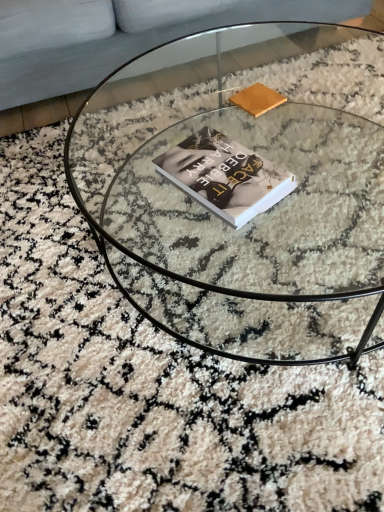
Describe the element at coordinates (257, 99) in the screenshot. I see `matte brown book at upper center` at that location.

This screenshot has height=512, width=384. What do you see at coordinates (236, 201) in the screenshot? I see `transparent glass coffee table at center` at bounding box center [236, 201].

What is the approximate width of transparent glass coffee table at center?

It is 3.38 feet.

The width and height of the screenshot is (384, 512). What do you see at coordinates (225, 176) in the screenshot?
I see `hardcover book at center` at bounding box center [225, 176].

Where is `light gray fabric couch at upper left`? The height and width of the screenshot is (512, 384). light gray fabric couch at upper left is located at coordinates (120, 40).

Is matte brown book at upper center at the back of light gray fabric couch at upper left?

No, light gray fabric couch at upper left's orientation is not away from matte brown book at upper center.

Measure the distance between light gray fabric couch at upper left and matte brown book at upper center.

The distance of light gray fabric couch at upper left from matte brown book at upper center is 31.44 inches.

Can you confirm if light gray fabric couch at upper left is positioned to the right of matte brown book at upper center?

Incorrect, light gray fabric couch at upper left is not on the right side of matte brown book at upper center.

From a real-world perspective, is light gray fabric couch at upper left over matte brown book at upper center?

No, from a real-world perspective, light gray fabric couch at upper left is not on top of matte brown book at upper center.

From the picture: Considering the relative sizes of hardcover book at center and matte brown book at upper center in the image provided, is hardcover book at center shorter than matte brown book at upper center?

In fact, hardcover book at center may be taller than matte brown book at upper center.

Based on the photo, does hardcover book at center appear on the left side of matte brown book at upper center?

Indeed, hardcover book at center is positioned on the left side of matte brown book at upper center.

Based on the photo, from a real-world perspective, is hardcover book at center on matte brown book at upper center?

Yes, from a real-world perspective, hardcover book at center is over matte brown book at upper center

Is hardcover book at center not inside matte brown book at upper center?

Yes, hardcover book at center is outside of matte brown book at upper center.

Considering the sizes of objects transparent glass coffee table at center and hardcover book at center in the image provided, who is taller, transparent glass coffee table at center or hardcover book at center?

transparent glass coffee table at center is taller.

Is transparent glass coffee table at center facing towards hardcover book at center?

No, transparent glass coffee table at center is not oriented towards hardcover book at center.

From the image's perspective, which one is positioned higher, transparent glass coffee table at center or hardcover book at center?

transparent glass coffee table at center is shown above in the image.

What's the angular difference between matte brown book at upper center and transparent glass coffee table at center's facing directions?

16.4 degrees separate the facing orientations of matte brown book at upper center and transparent glass coffee table at center.

Is matte brown book at upper center turned away from transparent glass coffee table at center?

Yes, matte brown book at upper center's orientation is away from transparent glass coffee table at center.

Is matte brown book at upper center smaller than transparent glass coffee table at center?

Yes, matte brown book at upper center is smaller than transparent glass coffee table at center.

From the picture: Are matte brown book at upper center and transparent glass coffee table at center making contact?

No, matte brown book at upper center is not touching transparent glass coffee table at center.

Which is closer to the camera, (x=251, y=103) or (x=355, y=10)?

Point (x=251, y=103)

Considering the relative sizes of matte brown book at upper center and light gray fabric couch at upper left in the image provided, is matte brown book at upper center smaller than light gray fabric couch at upper left?

Correct, matte brown book at upper center occupies less space than light gray fabric couch at upper left.

Would you consider transparent glass coffee table at center to be distant from matte brown book at upper center?

No, transparent glass coffee table at center is in close proximity to matte brown book at upper center.

Where is `paperback book on the left of transparent glass coffee table at center`? The height and width of the screenshot is (512, 384). paperback book on the left of transparent glass coffee table at center is located at coordinates (257, 99).

From a real-world perspective, is transparent glass coffee table at center on top of matte brown book at upper center?

No, from a real-world perspective, transparent glass coffee table at center is not on top of matte brown book at upper center.

Considering the relative sizes of transparent glass coffee table at center and matte brown book at upper center in the image provided, is transparent glass coffee table at center smaller than matte brown book at upper center?

No.

Which of these two, hardcover book at center or light gray fabric couch at upper left, is smaller?

Smaller between the two is hardcover book at center.

Is hardcover book at center directly adjacent to light gray fabric couch at upper left?

They are not placed beside each other.

Measure the distance between hardcover book at center and light gray fabric couch at upper left.

37.67 inches.

In the scene shown: Considering the relative positions of hardcover book at center and light gray fabric couch at upper left in the image provided, is hardcover book at center to the right of light gray fabric couch at upper left from the viewer's perspective?

Indeed, hardcover book at center is positioned on the right side of light gray fabric couch at upper left.

Find the location of a particular element. couch behind the matte brown book at upper center is located at coordinates (120, 40).

Image resolution: width=384 pixels, height=512 pixels. I want to click on paperback book beneath the hardcover book at center (from a real-world perspective), so click(x=257, y=99).

When comparing their distances from transparent glass coffee table at center, does hardcover book at center or light gray fabric couch at upper left seem further?

light gray fabric couch at upper left.

Estimate the real-world distances between objects in this image. Which object is closer to hardcover book at center, light gray fabric couch at upper left or transparent glass coffee table at center?

transparent glass coffee table at center is positioned closer to the anchor hardcover book at center.

Which object lies nearer to the anchor point transparent glass coffee table at center, light gray fabric couch at upper left or hardcover book at center?

hardcover book at center lies closer to transparent glass coffee table at center than the other object.

From the picture: Estimate the real-world distances between objects in this image. Which object is further from matte brown book at upper center, hardcover book at center or light gray fabric couch at upper left?

light gray fabric couch at upper left is further to matte brown book at upper center.

In the scene shown: Considering their positions, is matte brown book at upper center positioned further to hardcover book at center than transparent glass coffee table at center?

transparent glass coffee table at center is positioned further to the anchor hardcover book at center.

Looking at the image, which one is located closer to light gray fabric couch at upper left, transparent glass coffee table at center or matte brown book at upper center?

transparent glass coffee table at center lies closer to light gray fabric couch at upper left than the other object.

Considering their positions, is matte brown book at upper center positioned further to transparent glass coffee table at center than light gray fabric couch at upper left?

light gray fabric couch at upper left is positioned further to the anchor transparent glass coffee table at center.

Looking at this image, from the image, which object appears to be nearer to matte brown book at upper center, hardcover book at center or transparent glass coffee table at center?

hardcover book at center is closer to matte brown book at upper center.

You are a GUI agent. You are given a task and a screenshot of the screen. Output one action in this format:
    pyautogui.click(x=<x>, y=<y>)
    Task: Click on the paperback book between light gray fabric couch at upper left and hardcover book at center in the up-down direction
    This screenshot has height=512, width=384.
    Given the screenshot: What is the action you would take?
    pyautogui.click(x=257, y=99)

This screenshot has height=512, width=384. Identify the location of paperback book between light gray fabric couch at upper left and transparent glass coffee table at center from top to bottom. (257, 99).

You are a GUI agent. You are given a task and a screenshot of the screen. Output one action in this format:
    pyautogui.click(x=<x>, y=<y>)
    Task: Click on the book between transparent glass coffee table at center and matte brown book at upper center along the z-axis
    The image size is (384, 512).
    Given the screenshot: What is the action you would take?
    pyautogui.click(x=225, y=176)

Where is `coffee table between light gray fabric couch at upper left and hardcover book at center in the up-down direction`? The image size is (384, 512). coffee table between light gray fabric couch at upper left and hardcover book at center in the up-down direction is located at coordinates (236, 201).